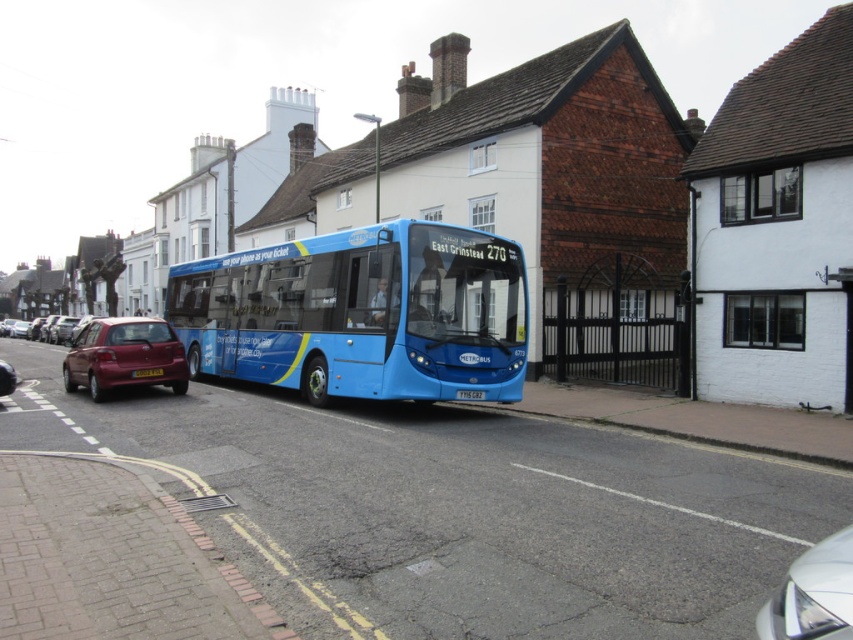
You are a pedestrian standing on the sidewalk and want to cross the street to reach the white plastic license plate at center. There is a metallic red car at left blocking your path. Can you walk around the car to get to the license plate?

The metallic red car at left is closer to the viewer than the white plastic license plate at center, so you can walk around the car to reach the license plate.

You are a delivery driver who needs to attach a new license plate to your vehicle. The new plate you have is 12 inches wide. You see the yellow metallic license plate at center and the white plastic license plate at center in the image. Which of these license plates can accommodate the new 12 inch plate?

The white plastic license plate at center is larger in size compared to the yellow metallic license plate at center. Since the new plate is 12 inches wide, the white plastic license plate at center can accommodate it as it is bigger.

You are a traffic officer checking license plates in the scene. You see the yellow metallic license plate at center and the white plastic license plate at center. Which license plate is positioned to the right side?

The yellow metallic license plate at center is positioned to the right of the white plastic license plate at center.